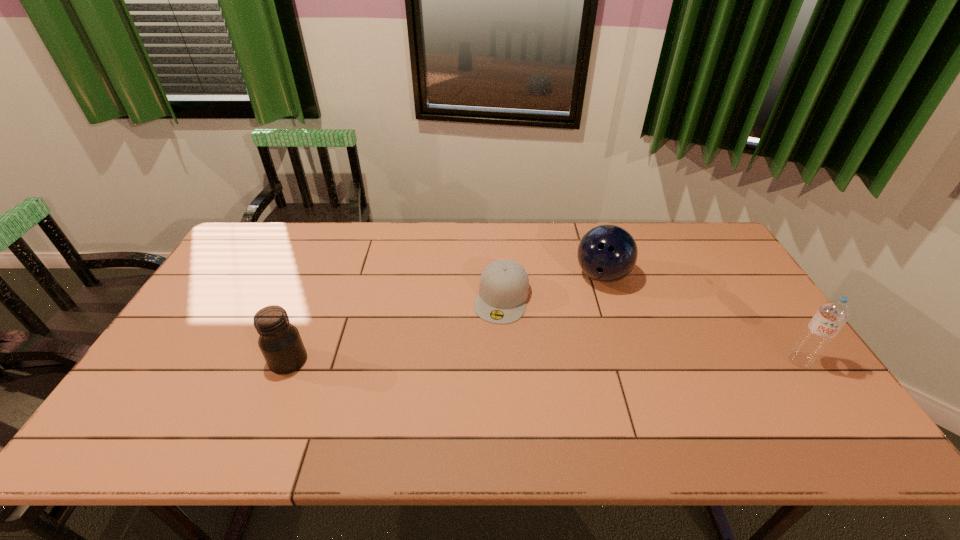
Identify the location of free point between the shortest object and the bowling ball. This screenshot has width=960, height=540. (552, 287).

At what (x,y) coordinates should I click in order to perform the action: click on empty space that is in between the leftmost object and the second object from left to right. Please return your answer as a coordinate pair (x, y). Looking at the image, I should click on (396, 329).

Identify which object is located as the nearest to the rightmost object. Please provide its 2D coordinates. Your answer should be formatted as a tuple, i.e. [(x, y)], where the tuple contains the x and y coordinates of a point satisfying the conditions above.

[(607, 253)]

This screenshot has width=960, height=540. What are the coordinates of `object that ranks as the third closest to the water bottle` in the screenshot? It's located at (280, 342).

Image resolution: width=960 pixels, height=540 pixels. I want to click on vacant space that satisfies the following two spatial constraints: 1. on the back side of the leftmost object; 2. on the right side of the third object from left to right, so click(324, 276).

Where is `vacant area that satisfies the following two spatial constraints: 1. on the back side of the bowling ball; 2. on the left side of the leftmost object`? The width and height of the screenshot is (960, 540). vacant area that satisfies the following two spatial constraints: 1. on the back side of the bowling ball; 2. on the left side of the leftmost object is located at coordinates (324, 276).

The width and height of the screenshot is (960, 540). I want to click on blank space that satisfies the following two spatial constraints: 1. on the front side of the rightmost object; 2. on the left side of the bowling ball, so click(629, 360).